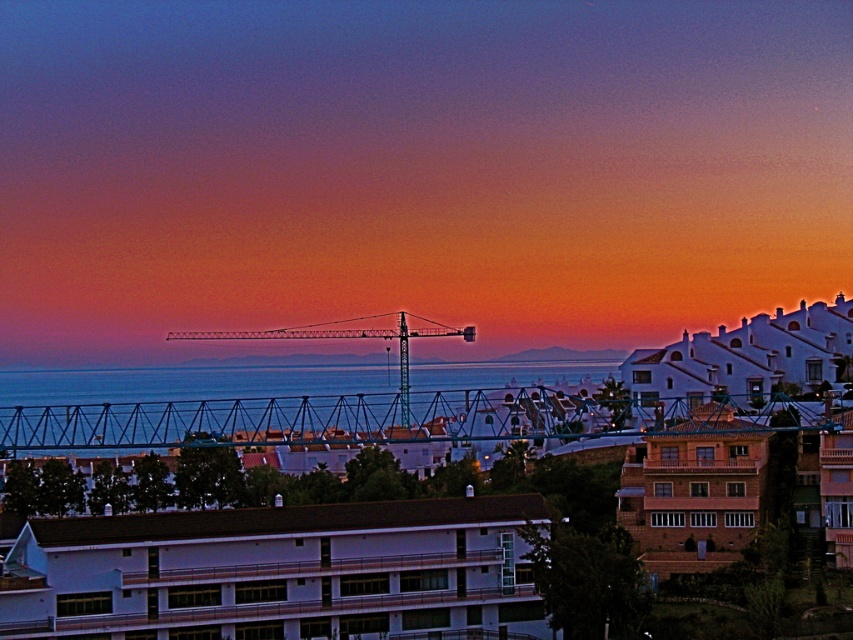
Looking at this image, you are standing at the point marked as point [193,381] in the image. Looking around, you see blue water at center. Can you confirm if you are currently standing on the blue water at center?

Yes, the point [193,381] is on blue water at center, so you are standing on the blue water at center.

You are a photographer planning to capture the teal metallic crane at center and the blue water at center in a single frame. Based on their positions, which object should you focus on first to ensure both are in the shot?

The teal metallic crane at center is on the left side of the blue water at center, so you should focus on the teal metallic crane at center first to ensure both objects are included in the frame.